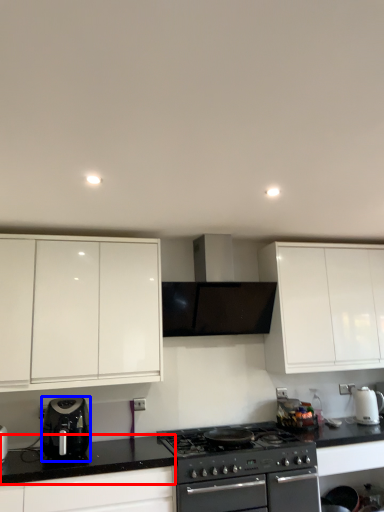
Question: Which object appears closest to the camera in this image, counter top (highlighted by a red box) or kitchen appliance (highlighted by a blue box)?

Choices:
 (A) counter top
 (B) kitchen appliance

Answer: (A)